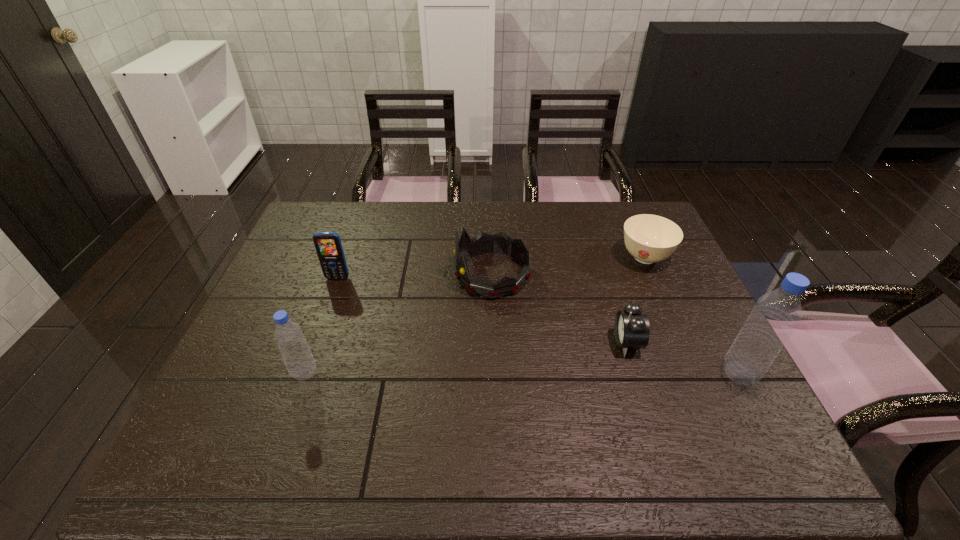
This screenshot has height=540, width=960. I want to click on free space between the sugar bowl and the taller bottle, so click(692, 315).

I want to click on vacant space that is in between the sugar bowl and the right bottle, so click(x=692, y=315).

What are the coordinates of `vacant area that lies between the cellular telephone and the right bottle` in the screenshot? It's located at (539, 326).

Where is `vacant point located between the fourth object from left to right and the cellular telephone`? This screenshot has width=960, height=540. vacant point located between the fourth object from left to right and the cellular telephone is located at coordinates (482, 310).

The image size is (960, 540). Identify the location of vacant region between the third object from right to left and the third object from left to right. (560, 308).

Locate an element on the screen. The width and height of the screenshot is (960, 540). unoccupied position between the alarm clock and the cellular telephone is located at coordinates (482, 310).

Where is `vacant space that is in between the alarm clock and the shorter bottle`? The image size is (960, 540). vacant space that is in between the alarm clock and the shorter bottle is located at coordinates (466, 357).

The height and width of the screenshot is (540, 960). Identify the location of free spot between the fourth object from right to left and the fourth object from left to right. (560, 308).

This screenshot has height=540, width=960. I want to click on vacant area between the second tallest object and the third object from left to right, so click(398, 323).

Select which object is the second closest to the third object from left to right. Please provide its 2D coordinates. Your answer should be formatted as a tuple, i.e. [(x, y)], where the tuple contains the x and y coordinates of a point satisfying the conditions above.

[(648, 238)]